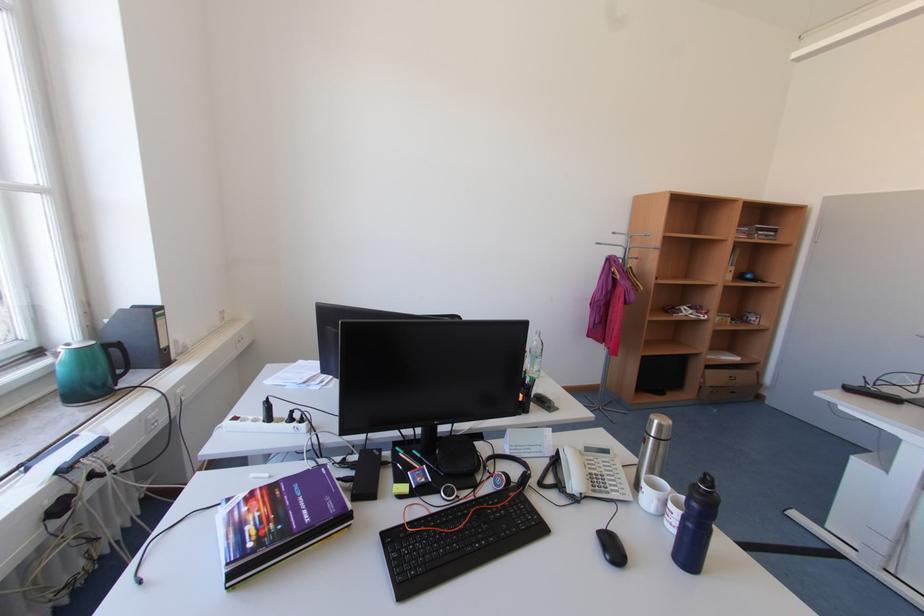
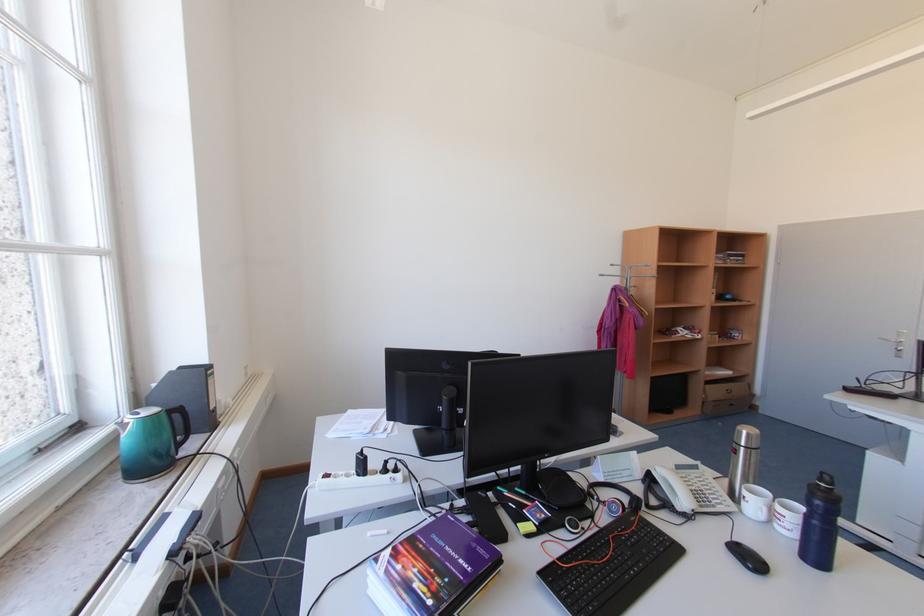
Locate, in the second image, the point that corresponds to (577,492) in the first image.

(687, 509)